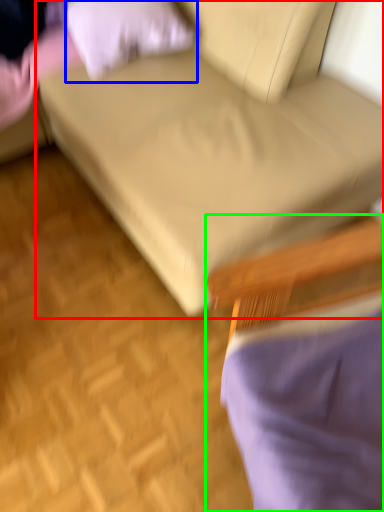
Question: Based on their relative distances, which object is nearer to studio couch (highlighted by a red box)? Choose from pillow (highlighted by a blue box) and chair (highlighted by a green box).

Choices:
 (A) pillow
 (B) chair

Answer: (A)